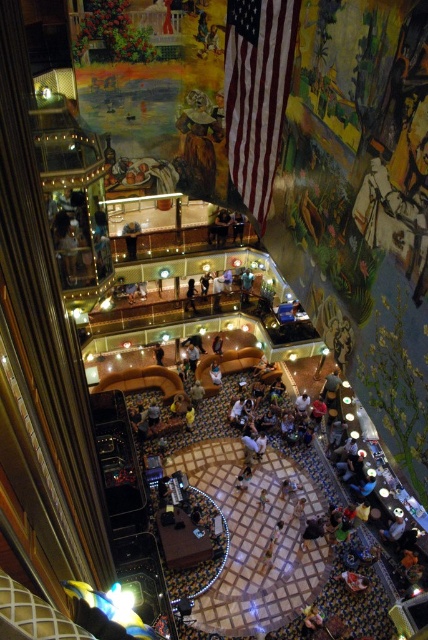
Question: Does light brown leather couch at center appear on the left side of dark brown leather couch at center?

Choices:
 (A) yes
 (B) no

Answer: (A)

Question: Which object appears closest to the camera in this image?

Choices:
 (A) dark blue shirt at center
 (B) light brown leather couch at center

Answer: (B)

Question: Which is farther from the dark brown leather couch at center?

Choices:
 (A) dark blue shirt at center
 (B) light brown leather jacket at center

Answer: (A)

Question: Is light brown leather jacket at center smaller than dark blue shirt at center?

Choices:
 (A) no
 (B) yes

Answer: (A)

Question: Which point is closer to the camera?

Choices:
 (A) silhouette of person at center
 (B) dark blue shirt at center
 (C) dark brown leather couch at center
 (D) light brown leather couch at center

Answer: (D)

Question: Can you confirm if light brown leather couch at center is bigger than dark blue shirt at center?

Choices:
 (A) no
 (B) yes

Answer: (B)